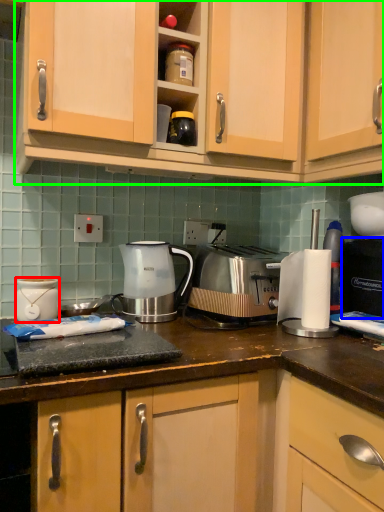
Question: Which is nearer to the kitchen appliance (highlighted by a red box)? home appliance (highlighted by a blue box) or cabinetry (highlighted by a green box).

Choices:
 (A) home appliance
 (B) cabinetry

Answer: (B)